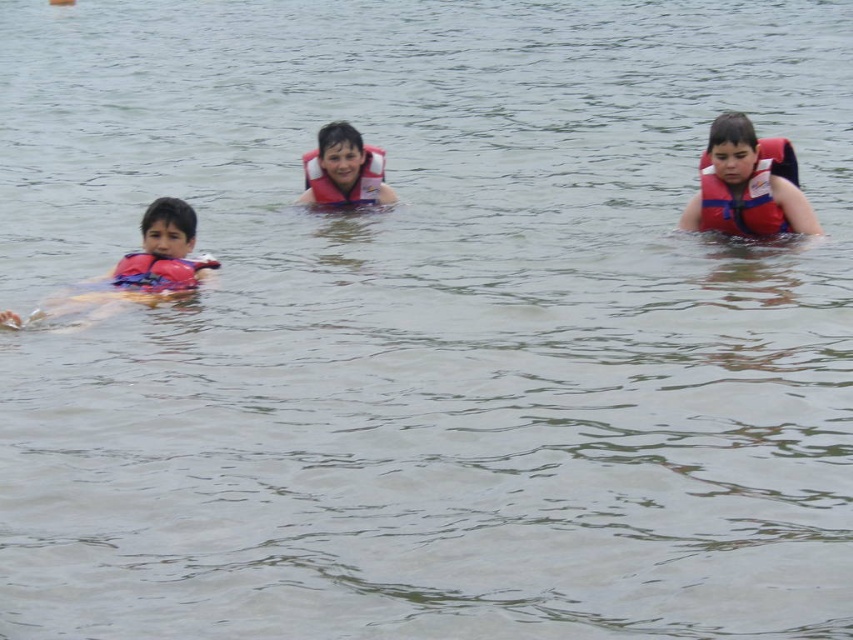
Question: From the image, what is the correct spatial relationship of red matte life jacket at right in relation to rubber/foam life jacket at left?

Choices:
 (A) right
 (B) left

Answer: (A)

Question: Which point is closer to the camera?

Choices:
 (A) (383, 154)
 (B) (769, 234)

Answer: (B)

Question: Which object is positioned closest to the red matte life jacket at right?

Choices:
 (A) pink foam float at left
 (B) matte pink life jacket at center

Answer: (B)

Question: Does red matte life jacket at right come in front of matte pink life jacket at center?

Choices:
 (A) no
 (B) yes

Answer: (B)

Question: Is red matte life jacket at right bigger than matte pink life jacket at center?

Choices:
 (A) yes
 (B) no

Answer: (A)

Question: Which object appears farthest from the camera in this image?

Choices:
 (A) red matte life jacket at right
 (B) matte pink life jacket at center
 (C) rubber/foam life jacket at left

Answer: (B)